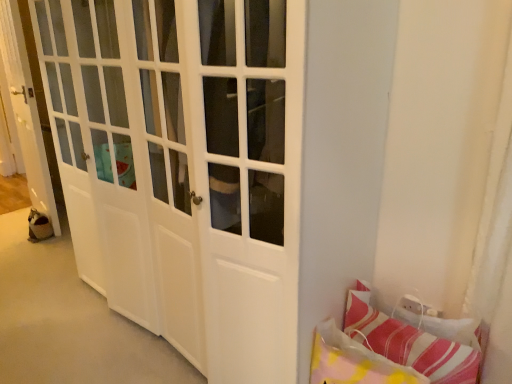
Describe the element at coordinates (353, 361) in the screenshot. I see `striped fabric pillow at lower right, which ranks as the second pillow in right-to-left order` at that location.

Where is `striped fabric pillow at lower right, which appears as the 1th pillow when viewed from the right`? The height and width of the screenshot is (384, 512). striped fabric pillow at lower right, which appears as the 1th pillow when viewed from the right is located at coordinates (409, 343).

Which is in front, striped fabric pillow at lower right, which is the 1th pillow from left to right, or striped fabric pillow at lower right, the 2th pillow in the left-to-right sequence?

striped fabric pillow at lower right, which is the 1th pillow from left to right, is more forward.

In the image, there is a striped fabric pillow at lower right, which appears as the 1th pillow when viewed from the right. In order to click on pillow below it (from a real-world perspective) in this screenshot , I will do pos(353,361).

Considering the positions of points (325, 366) and (465, 357), is point (325, 366) closer to camera compared to point (465, 357)?

No, (325, 366) is behind (465, 357).

Does striped fabric pillow at lower right, which ranks as the second pillow in right-to-left order, appear on the left side of striped fabric pillow at lower right, the 2th pillow in the left-to-right sequence?

Correct, you'll find striped fabric pillow at lower right, which ranks as the second pillow in right-to-left order, to the left of striped fabric pillow at lower right, the 2th pillow in the left-to-right sequence.

From the image's perspective, would you say striped fabric pillow at lower right, which is the 1th pillow from left to right, is positioned over white glossy door at left?

No.

Is striped fabric pillow at lower right, which is the 1th pillow from left to right, touching white glossy door at left?

striped fabric pillow at lower right, which is the 1th pillow from left to right, and white glossy door at left are not in contact.

Find the location of `the 2nd pillow located beneath the white glossy door at left (from a real-world perspective)`. the 2nd pillow located beneath the white glossy door at left (from a real-world perspective) is located at coordinates (353, 361).

In terms of size, does striped fabric pillow at lower right, which is the 1th pillow from left to right, appear bigger or smaller than white glossy door at left?

Considering their sizes, striped fabric pillow at lower right, which is the 1th pillow from left to right, takes up less space than white glossy door at left.

Considering the positions of points (355, 324) and (5, 30), is point (355, 324) farther from camera compared to point (5, 30)?

No, (355, 324) is closer to viewer.

From the image's perspective, would you say striped fabric pillow at lower right, the 2th pillow in the left-to-right sequence, is shown under white glossy door at left?

Yes.

Can you confirm if striped fabric pillow at lower right, the 2th pillow in the left-to-right sequence, is thinner than white glossy door at left?

Correct, the width of striped fabric pillow at lower right, the 2th pillow in the left-to-right sequence, is less than that of white glossy door at left.

Is striped fabric pillow at lower right, the 2th pillow in the left-to-right sequence, smaller than white glossy door at left?

Correct, striped fabric pillow at lower right, the 2th pillow in the left-to-right sequence, occupies less space than white glossy door at left.

From a real-world perspective, is striped fabric pillow at lower right, which appears as the 1th pillow when viewed from the right, over striped fabric pillow at lower right, which is the 1th pillow from left to right?

Yes.

Considering the positions of point (362, 337) and point (325, 333), is point (362, 337) closer or farther from the camera than point (325, 333)?

Point (362, 337) appears to be farther away from the viewer than point (325, 333).

From the image's perspective, is striped fabric pillow at lower right, which appears as the 1th pillow when viewed from the right, located above or below striped fabric pillow at lower right, which is the 1th pillow from left to right?

striped fabric pillow at lower right, which appears as the 1th pillow when viewed from the right, is situated higher than striped fabric pillow at lower right, which is the 1th pillow from left to right, in the image.

Consider the image. Is striped fabric pillow at lower right, the 2th pillow in the left-to-right sequence, completely or partially inside white glossy door at left?

No.

Which object is more forward, white glossy door at left or striped fabric pillow at lower right, which appears as the 1th pillow when viewed from the right?

striped fabric pillow at lower right, which appears as the 1th pillow when viewed from the right.

Which of these two, white glossy door at left or striped fabric pillow at lower right, which appears as the 1th pillow when viewed from the right, is wider?

white glossy door at left.

Based on their sizes in the image, would you say white glossy door at left is bigger or smaller than striped fabric pillow at lower right, which is the 1th pillow from left to right?

Clearly, white glossy door at left is larger in size than striped fabric pillow at lower right, which is the 1th pillow from left to right.

From a real-world perspective, is white glossy door at left positioned above or below striped fabric pillow at lower right, which ranks as the second pillow in right-to-left order?

In terms of real-world spatial position, white glossy door at left is above striped fabric pillow at lower right, which ranks as the second pillow in right-to-left order.

Could you tell me if white glossy door at left is turned towards striped fabric pillow at lower right, which is the 1th pillow from left to right?

No, white glossy door at left is not aimed at striped fabric pillow at lower right, which is the 1th pillow from left to right.

Is point (20, 125) closer to viewer compared to point (326, 331)?

That is False.

Identify the location of pillow in front of the striped fabric pillow at lower right, the 2th pillow in the left-to-right sequence. This screenshot has height=384, width=512. (353, 361).

Locate an element on the screen. The width and height of the screenshot is (512, 384). the 2nd pillow below the white glossy door at left (from a real-world perspective) is located at coordinates (353, 361).

Consider the image. Looking at the image, which one is located closer to striped fabric pillow at lower right, which appears as the 1th pillow when viewed from the right, striped fabric pillow at lower right, which is the 1th pillow from left to right, or white glossy door at left?

striped fabric pillow at lower right, which is the 1th pillow from left to right, is closer to striped fabric pillow at lower right, which appears as the 1th pillow when viewed from the right.

Based on their spatial positions, is striped fabric pillow at lower right, which appears as the 1th pillow when viewed from the right, or striped fabric pillow at lower right, which ranks as the second pillow in right-to-left order, further from white glossy door at left?

striped fabric pillow at lower right, which appears as the 1th pillow when viewed from the right, lies further to white glossy door at left than the other object.

Considering their positions, is striped fabric pillow at lower right, which is the 1th pillow from left to right, positioned further to white glossy door at left than striped fabric pillow at lower right, which appears as the 1th pillow when viewed from the right?

striped fabric pillow at lower right, which appears as the 1th pillow when viewed from the right, is further to white glossy door at left.

Based on the photo, when comparing their distances from striped fabric pillow at lower right, which is the 1th pillow from left to right, does white glossy door at left or striped fabric pillow at lower right, which appears as the 1th pillow when viewed from the right, seem further?

The object further to striped fabric pillow at lower right, which is the 1th pillow from left to right, is white glossy door at left.

From the image, which object appears to be farther from striped fabric pillow at lower right, which appears as the 1th pillow when viewed from the right, white glossy door at left or striped fabric pillow at lower right, which is the 1th pillow from left to right?

Based on the image, white glossy door at left appears to be further to striped fabric pillow at lower right, which appears as the 1th pillow when viewed from the right.

Estimate the real-world distances between objects in this image. Which object is further from striped fabric pillow at lower right, which is the 1th pillow from left to right, striped fabric pillow at lower right, the 2th pillow in the left-to-right sequence, or white glossy door at left?

white glossy door at left lies further to striped fabric pillow at lower right, which is the 1th pillow from left to right, than the other object.

Locate an element on the screen. This screenshot has height=384, width=512. pillow located between white glossy door at left and striped fabric pillow at lower right, the 2th pillow in the left-to-right sequence, in the left-right direction is located at coordinates (353, 361).